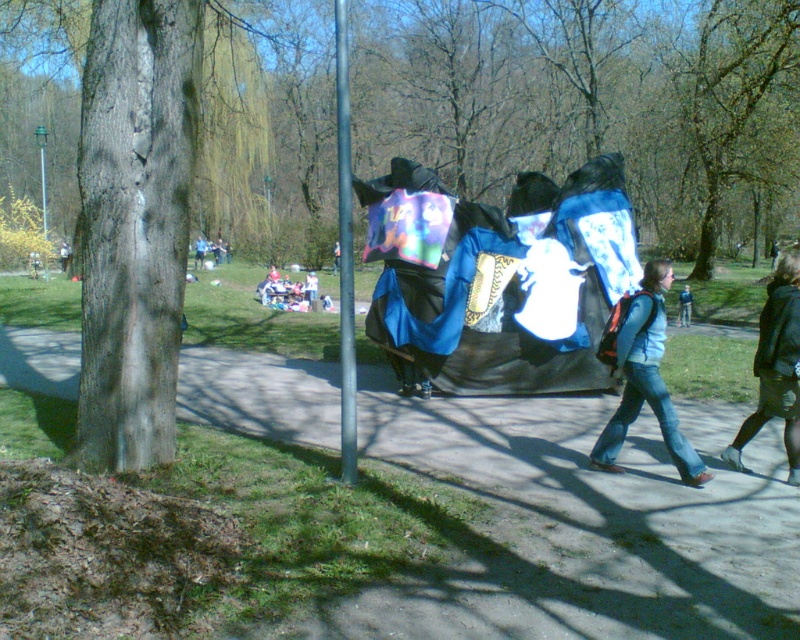
Question: Can you confirm if paved concrete sidewalk at center is smaller than blue fabric backpack at center-right?

Choices:
 (A) yes
 (B) no

Answer: (B)

Question: Among these points, which one is farthest from the camera?

Choices:
 (A) (194, 248)
 (B) (684, 296)
 (C) (782, 273)
 (D) (664, 330)

Answer: (A)

Question: Is paved concrete sidewalk at center behind blue fabric at center?

Choices:
 (A) yes
 (B) no

Answer: (B)

Question: Among these points, which one is farthest from the camera?

Choices:
 (A) (741, 442)
 (B) (197, 237)
 (C) (334, 26)

Answer: (C)

Question: Can you confirm if blue fabric picnic table at center is positioned below blue fabric at center?

Choices:
 (A) yes
 (B) no

Answer: (A)

Question: Which object is the farthest from the blue fabric backpack at center-right?

Choices:
 (A) blue fabric picnic table at center
 (B) blue fabric at center

Answer: (B)